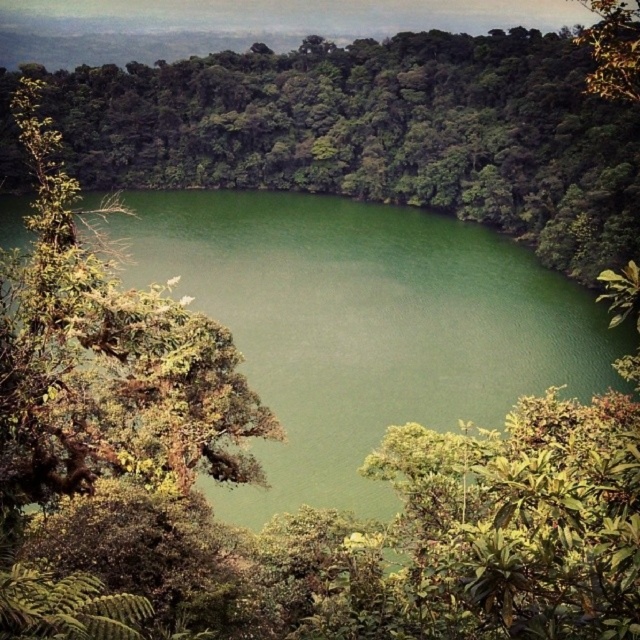
Question: In this image, where is green leafy tree at center located relative to green leafy tree at center-left?

Choices:
 (A) above
 (B) below

Answer: (A)

Question: Which point is farther to the camera?

Choices:
 (A) green leafy tree at center-left
 (B) green leafy tree at center

Answer: (B)

Question: Is green leafy tree at center above green leafy tree at center-left?

Choices:
 (A) no
 (B) yes

Answer: (B)

Question: Among these objects, which one is farthest from the camera?

Choices:
 (A) green leafy tree at center
 (B) green leafy tree at center-left

Answer: (A)

Question: Is green leafy tree at center smaller than green leafy tree at center-left?

Choices:
 (A) no
 (B) yes

Answer: (A)